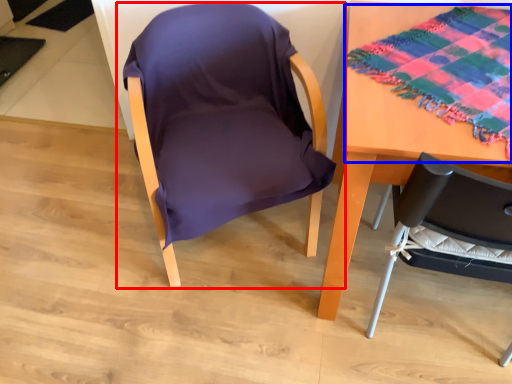
Question: Which object is further to the camera taking this photo, chair (highlighted by a red box) or blanket (highlighted by a blue box)?

Choices:
 (A) chair
 (B) blanket

Answer: (A)